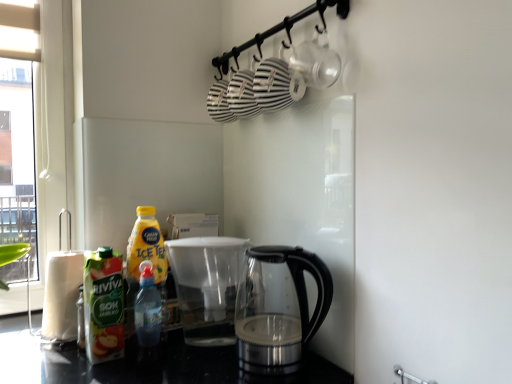
Question: Is the position of transparent glass kettle at lower center more distant than that of white paper towel at left?

Choices:
 (A) no
 (B) yes

Answer: (A)

Question: Is transparent glass kettle at lower center facing towards white paper towel at left?

Choices:
 (A) no
 (B) yes

Answer: (A)

Question: From the image's perspective, would you say transparent glass kettle at lower center is shown under white paper towel at left?

Choices:
 (A) no
 (B) yes

Answer: (A)

Question: Is transparent glass kettle at lower center located outside white paper towel at left?

Choices:
 (A) yes
 (B) no

Answer: (A)

Question: From a real-world perspective, is transparent glass kettle at lower center located higher than white paper towel at left?

Choices:
 (A) no
 (B) yes

Answer: (B)

Question: Does transparent glass kettle at lower center have a lesser height compared to white paper towel at left?

Choices:
 (A) yes
 (B) no

Answer: (B)

Question: Does transparent glass kettle at lower center appear on the left side of translucent plastic bottle at lower left, which appears as the first bottle when viewed from the right?

Choices:
 (A) no
 (B) yes

Answer: (A)

Question: Does transparent glass kettle at lower center have a larger size compared to translucent plastic bottle at lower left, which appears as the first bottle when viewed from the right?

Choices:
 (A) yes
 (B) no

Answer: (A)

Question: Is transparent glass kettle at lower center next to translucent plastic bottle at lower left, which appears as the first bottle when viewed from the right?

Choices:
 (A) no
 (B) yes

Answer: (A)

Question: Is transparent glass kettle at lower center facing away from translucent plastic bottle at lower left, positioned as the 2th bottle in left-to-right order?

Choices:
 (A) no
 (B) yes

Answer: (A)

Question: Is the depth of transparent glass kettle at lower center greater than that of translucent plastic bottle at lower left, which appears as the first bottle when viewed from the right?

Choices:
 (A) no
 (B) yes

Answer: (A)

Question: From the image's perspective, would you say transparent glass kettle at lower center is positioned over translucent plastic bottle at lower left, which appears as the first bottle when viewed from the right?

Choices:
 (A) yes
 (B) no

Answer: (A)

Question: Does white paper towel at left have a lesser width compared to translucent plastic bottle at lower left, which appears as the first bottle when viewed from the right?

Choices:
 (A) no
 (B) yes

Answer: (A)